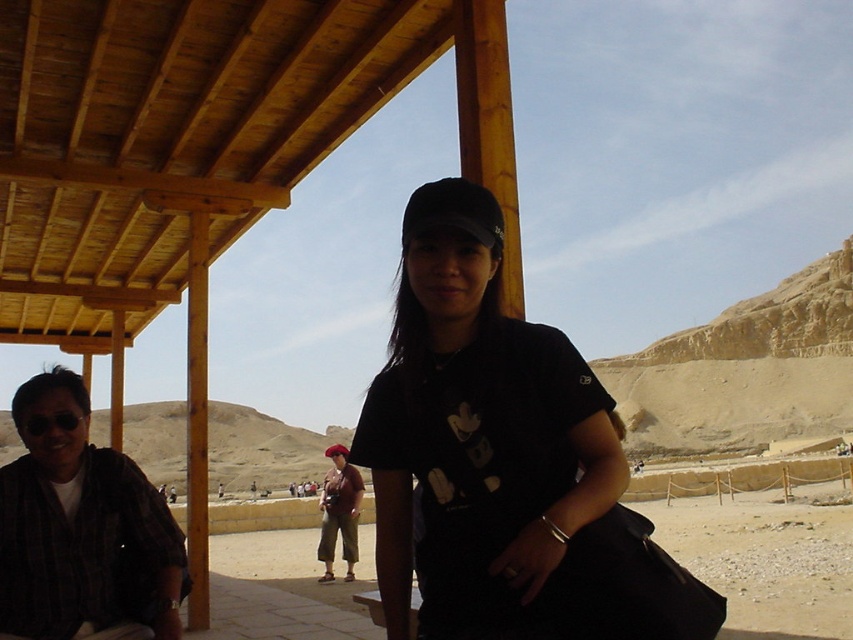
Which of these two, black matte shirt at center or red fabric beret at center, stands shorter?

red fabric beret at center is shorter.

Does black matte shirt at center have a lesser width compared to red fabric beret at center?

Incorrect, black matte shirt at center's width is not less than red fabric beret at center's.

Which is in front, point (462, 216) or point (352, 472)?

Point (462, 216) is more forward.

At what (x,y) coordinates should I click in order to perform the action: click on black matte shirt at center. Please return your answer as a coordinate pair (x, y). This screenshot has height=640, width=853. Looking at the image, I should click on (476, 433).

Looking at this image, between red fabric beret at center and matte black camera at center, which one has less height?

matte black camera at center is shorter.

Who is more forward, (335,492) or (303,483)?

Point (335,492)

Identify the location of red fabric beret at center. The height and width of the screenshot is (640, 853). [339, 513].

Measure the distance between point (293, 115) and camera.

Point (293, 115) and camera are 43.45 meters apart from each other.

Looking at this image, how much distance is there between wooden canopy at upper left and black matte shirt at center?

A distance of 14.92 meters exists between wooden canopy at upper left and black matte shirt at center.

What do you see at coordinates (201, 156) in the screenshot? I see `wooden canopy at upper left` at bounding box center [201, 156].

Locate an element on the screen. wooden canopy at upper left is located at coordinates (201, 156).